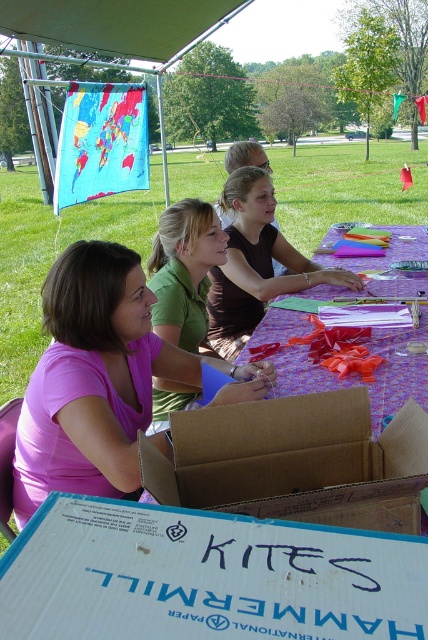
You are standing at the camera position and want to pick up the object at point [377,420]. Can you reach it without moving your feet?

The point [377,420] is 1.43 meters away from the camera. Since the average human arm length is about 0.7 meters, you cannot reach it without moving your feet.

You are a participant in the kite workshop and need to place a small sticker on the object that is taller between the pink matte shirt at center and the multicolored paper at center. Which object should you choose?

The multicolored paper at center is taller than the pink matte shirt at center, so you should place the sticker on the multicolored paper at center.